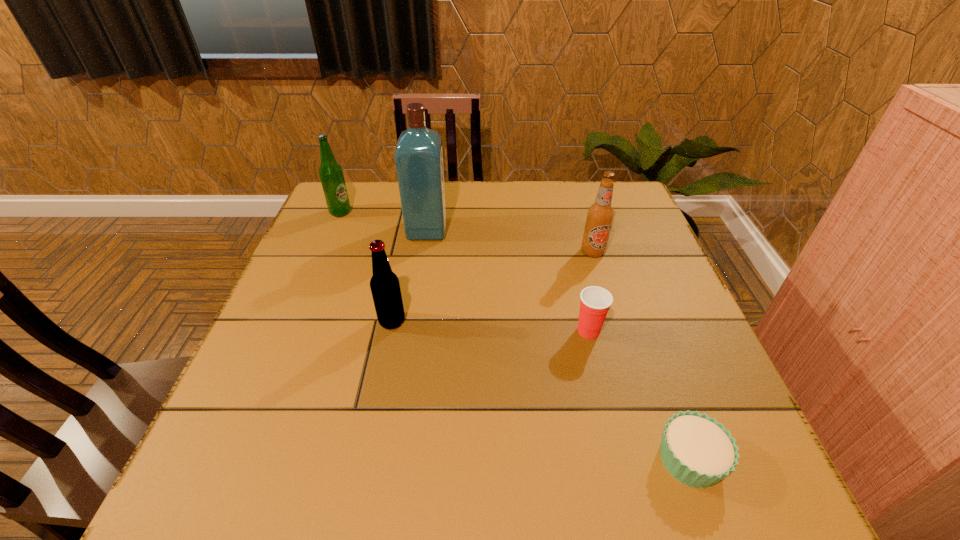
Image resolution: width=960 pixels, height=540 pixels. I want to click on unoccupied area between the nearest beer bottle and the Dixie cup, so click(x=491, y=326).

Image resolution: width=960 pixels, height=540 pixels. In order to click on free spot between the Dixie cup and the second farthest object in this screenshot , I will do `click(508, 281)`.

Where is `vacant area that lies between the nearest beer bottle and the Dixie cup`? vacant area that lies between the nearest beer bottle and the Dixie cup is located at coordinates (491, 326).

The height and width of the screenshot is (540, 960). What are the coordinates of `vacant region between the Dixie cup and the shortest object` in the screenshot? It's located at (639, 395).

Image resolution: width=960 pixels, height=540 pixels. In order to click on vacant space that's between the farthest beer bottle and the second beer bottle from left to right in this screenshot , I will do `click(366, 267)`.

Locate an element on the screen. This screenshot has height=540, width=960. empty space between the nearest beer bottle and the leftmost beer bottle is located at coordinates (366, 267).

Identify the location of free space that is in between the Dixie cup and the tallest object. (508, 281).

You are a GUI agent. You are given a task and a screenshot of the screen. Output one action in this format:
    pyautogui.click(x=<x>, y=<y>)
    Task: Click on the vacant area between the Dixie cup and the farthest beer bottle
    Image resolution: width=960 pixels, height=540 pixels.
    Given the screenshot: What is the action you would take?
    pyautogui.click(x=465, y=272)

This screenshot has width=960, height=540. Identify the location of empty space that is in between the shortest object and the second farthest object. (559, 345).

Locate an element on the screen. the second closest object to the nearest beer bottle is located at coordinates (595, 302).